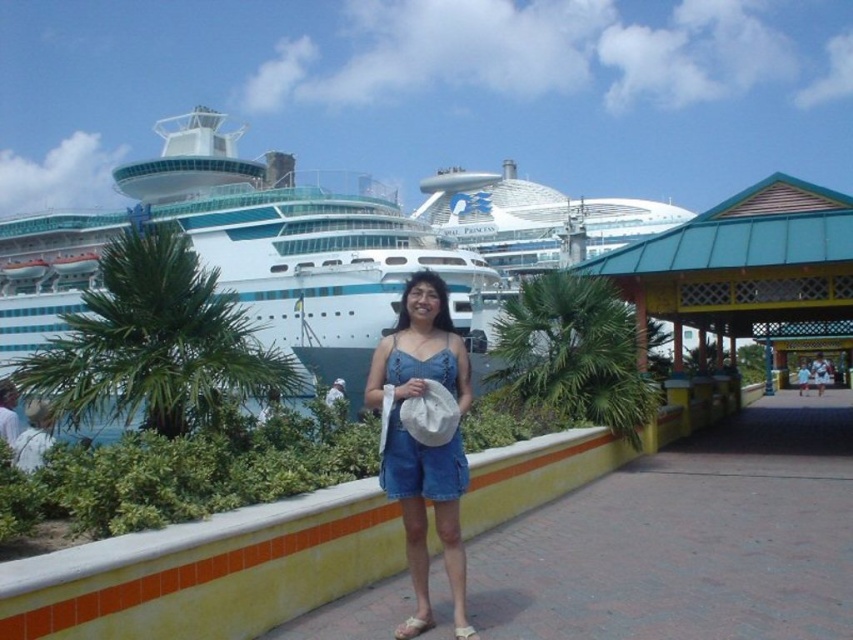
Question: Can you confirm if white glossy cruise ship at upper left is positioned to the right of white glossy cruise ship at center?

Choices:
 (A) no
 (B) yes

Answer: (A)

Question: Which object appears farthest from the camera in this image?

Choices:
 (A) denim shorts at center
 (B) white glossy cruise ship at upper left

Answer: (B)

Question: Does denim shorts at center appear under white glossy cruise ship at center?

Choices:
 (A) yes
 (B) no

Answer: (A)

Question: Considering the relative positions of white glossy cruise ship at upper left and white glossy cruise ship at center in the image provided, where is white glossy cruise ship at upper left located with respect to white glossy cruise ship at center?

Choices:
 (A) left
 (B) right

Answer: (A)

Question: Which of these objects is positioned farthest from the white glossy cruise ship at center?

Choices:
 (A) denim shorts at center
 (B) white glossy cruise ship at upper left

Answer: (A)

Question: Estimate the real-world distances between objects in this image. Which object is closer to the white glossy cruise ship at center?

Choices:
 (A) white glossy cruise ship at upper left
 (B) denim shorts at center

Answer: (A)